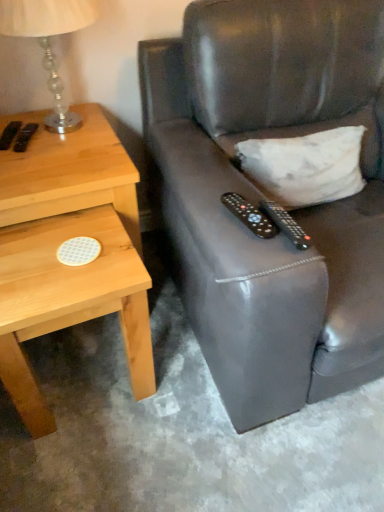
Describe the element at coordinates (49, 42) in the screenshot. The image size is (384, 512). I see `translucent glass lamp at upper left` at that location.

Measure the distance between point (264, 213) and camera.

36.61 inches.

What do you see at coordinates (250, 215) in the screenshot? I see `black plastic remote control at center, which is the 1th remote control in left-to-right order` at bounding box center [250, 215].

What is the approximate width of light wood/texture nightstand at left?

52.07 centimeters.

You are a GUI agent. You are given a task and a screenshot of the screen. Output one action in this format:
    pyautogui.click(x=<x>, y=<y>)
    Task: Click on the leather couch at right
    The height and width of the screenshot is (512, 384).
    Given the screenshot: What is the action you would take?
    pyautogui.click(x=260, y=196)

Is translucent glass lamp at upper left turned away from black plastic remote control at center, which is the 1th remote control in left-to-right order?

translucent glass lamp at upper left is not turned away from black plastic remote control at center, which is the 1th remote control in left-to-right order.

From the image's perspective, is translucent glass lamp at upper left located above black plastic remote control at center, which is the 1th remote control in left-to-right order?

Yes, from the image's perspective, translucent glass lamp at upper left is over black plastic remote control at center, which is the 1th remote control in left-to-right order.

Considering the sizes of translucent glass lamp at upper left and black plastic remote control at center, which is the 1th remote control in left-to-right order, in the image, is translucent glass lamp at upper left wider or thinner than black plastic remote control at center, which is the 1th remote control in left-to-right order,?

Considering their sizes, translucent glass lamp at upper left looks broader than black plastic remote control at center, which is the 1th remote control in left-to-right order.

From their relative heights in the image, would you say translucent glass lamp at upper left is taller or shorter than black plastic remote control at center, which is the 1th remote control in left-to-right order?

Clearly, translucent glass lamp at upper left is taller compared to black plastic remote control at center, which is the 1th remote control in left-to-right order.

How many degrees apart are the facing directions of leather couch at right and translucent glass lamp at upper left?

The angle between the facing direction of leather couch at right and the facing direction of translucent glass lamp at upper left is 5.67 degrees.

Is leather couch at right not within translucent glass lamp at upper left?

Absolutely, leather couch at right is external to translucent glass lamp at upper left.

Which object is wider, leather couch at right or translucent glass lamp at upper left?

With larger width is leather couch at right.

Is translucent glass lamp at upper left placed right next to white matte pillow at upper right?

No, translucent glass lamp at upper left is not making contact with white matte pillow at upper right.

Based on the photo, can you confirm if translucent glass lamp at upper left is taller than white matte pillow at upper right?

Correct, translucent glass lamp at upper left is much taller as white matte pillow at upper right.

Is translucent glass lamp at upper left not inside white matte pillow at upper right?

Absolutely, translucent glass lamp at upper left is external to white matte pillow at upper right.

Is translucent glass lamp at upper left turned away from light wood/texture nightstand at left?

No, light wood/texture nightstand at left is not at the back of translucent glass lamp at upper left.

Can we say translucent glass lamp at upper left lies outside light wood/texture nightstand at left?

Absolutely, translucent glass lamp at upper left is external to light wood/texture nightstand at left.

From a real-world perspective, is translucent glass lamp at upper left on top of light wood/texture nightstand at left?

Yes.

From the picture: How distant is translucent glass lamp at upper left from light wood/texture nightstand at left?

translucent glass lamp at upper left is 14.92 inches from light wood/texture nightstand at left.

In terms of height, does leather couch at right look taller or shorter compared to black plastic remote control at center, the first remote control from the right?

In the image, leather couch at right appears to be taller than black plastic remote control at center, the first remote control from the right.

From the image's perspective, which is below, leather couch at right or black plastic remote control at center, which ranks as the second remote control in left-to-right order?

From the image's view, black plastic remote control at center, which ranks as the second remote control in left-to-right order, is below.

Is point (298, 318) closer or farther from the camera than point (278, 212)?

Point (298, 318) appears to be closer to the viewer than point (278, 212).

In terms of size, does leather couch at right appear bigger or smaller than black plastic remote control at center, the first remote control from the right?

Considering their sizes, leather couch at right takes up more space than black plastic remote control at center, the first remote control from the right.

Is black plastic remote control at center, which ranks as the second remote control in right-to-left order, at the back of leather couch at right?

No, leather couch at right is not facing the opposite direction of black plastic remote control at center, which ranks as the second remote control in right-to-left order.

Find the location of `the 2nd remote control behind the leather couch at right, starting your count from the anchor`. the 2nd remote control behind the leather couch at right, starting your count from the anchor is located at coordinates (250, 215).

Which of these two, leather couch at right or black plastic remote control at center, which is the 1th remote control in left-to-right order, stands taller?

Standing taller between the two is leather couch at right.

Between leather couch at right and black plastic remote control at center, which is the 1th remote control in left-to-right order, which one has smaller width?

Thinner between the two is black plastic remote control at center, which is the 1th remote control in left-to-right order.

Can you confirm if black plastic remote control at center, which is the 1th remote control in left-to-right order, is smaller than leather couch at right?

Indeed, black plastic remote control at center, which is the 1th remote control in left-to-right order, has a smaller size compared to leather couch at right.

Image resolution: width=384 pixels, height=512 pixels. I want to click on chair that appears above the black plastic remote control at center, which is the 1th remote control in left-to-right order (from the image's perspective), so click(x=260, y=196).

From a real-world perspective, which object rests below the other?

leather couch at right, from a real-world perspective.

You are a GUI agent. You are given a task and a screenshot of the screen. Output one action in this format:
    pyautogui.click(x=<x>, y=<y>)
    Task: Click on the table lamp on the left of black plastic remote control at center, which is the 1th remote control in left-to-right order
    The width and height of the screenshot is (384, 512).
    Given the screenshot: What is the action you would take?
    click(x=49, y=42)

Identify the location of table lamp above the leather couch at right (from the image's perspective). (49, 42).

From the image, which object appears to be farther from leather couch at right, black plastic remote control at center, the first remote control from the right, or black plastic remote control at center, which is the 1th remote control in left-to-right order?

Based on the image, black plastic remote control at center, which is the 1th remote control in left-to-right order, appears to be further to leather couch at right.

From the image, which object appears to be farther from light wood/texture nightstand at left, black plastic remote control at center, the first remote control from the right, or translucent glass lamp at upper left?

black plastic remote control at center, the first remote control from the right, is further to light wood/texture nightstand at left.

When comparing their distances from light wood/texture nightstand at left, does translucent glass lamp at upper left or white matte pillow at upper right seem closer?

translucent glass lamp at upper left.

From the image, which object appears to be farther from white matte pillow at upper right, translucent glass lamp at upper left or light wood/texture nightstand at left?

The object further to white matte pillow at upper right is translucent glass lamp at upper left.

Looking at the image, which one is located closer to black plastic remote control at center, the first remote control from the right, translucent glass lamp at upper left or leather couch at right?

leather couch at right is closer to black plastic remote control at center, the first remote control from the right.

From the image, which object appears to be nearer to black plastic remote control at center, which ranks as the second remote control in left-to-right order, white matte pillow at upper right or black plastic remote control at center, which is the 1th remote control in left-to-right order?

The object closer to black plastic remote control at center, which ranks as the second remote control in left-to-right order, is black plastic remote control at center, which is the 1th remote control in left-to-right order.

From the image, which object appears to be nearer to light wood/texture nightstand at left, black plastic remote control at center, which is the 1th remote control in left-to-right order, or white matte pillow at upper right?

Based on the image, black plastic remote control at center, which is the 1th remote control in left-to-right order, appears to be nearer to light wood/texture nightstand at left.

Which object lies nearer to the anchor point black plastic remote control at center, the first remote control from the right, light wood/texture nightstand at left or translucent glass lamp at upper left?

light wood/texture nightstand at left is positioned closer to the anchor black plastic remote control at center, the first remote control from the right.

Where is `remote control located between translucent glass lamp at upper left and black plastic remote control at center, the first remote control from the right, in the left-right direction`? remote control located between translucent glass lamp at upper left and black plastic remote control at center, the first remote control from the right, in the left-right direction is located at coordinates (250, 215).

The image size is (384, 512). Find the location of `table lamp located between light wood/texture nightstand at left and leather couch at right in the left-right direction`. table lamp located between light wood/texture nightstand at left and leather couch at right in the left-right direction is located at coordinates (49, 42).

Image resolution: width=384 pixels, height=512 pixels. I want to click on pillow situated between light wood/texture nightstand at left and leather couch at right from left to right, so click(x=305, y=166).

Find the location of a particular element. This screenshot has width=384, height=512. remote control positioned between leather couch at right and black plastic remote control at center, which ranks as the second remote control in right-to-left order, from near to far is located at coordinates point(285,224).